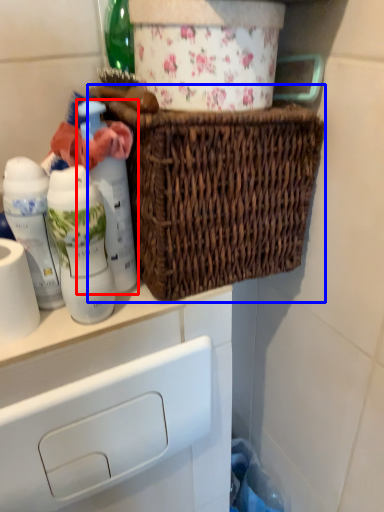
Question: Which object is closer to the camera taking this photo, bottle (highlighted by a red box) or picnic basket (highlighted by a blue box)?

Choices:
 (A) bottle
 (B) picnic basket

Answer: (B)